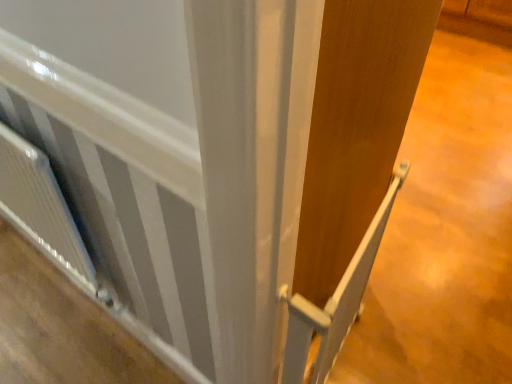
Question: Is white glossy radiator at lower left bigger than white plastic rail at center?

Choices:
 (A) yes
 (B) no

Answer: (B)

Question: From a real-world perspective, is white glossy radiator at lower left on top of white plastic rail at center?

Choices:
 (A) no
 (B) yes

Answer: (A)

Question: Is there a large distance between white glossy radiator at lower left and white plastic rail at center?

Choices:
 (A) yes
 (B) no

Answer: (B)

Question: Is white glossy radiator at lower left positioned before white plastic rail at center?

Choices:
 (A) yes
 (B) no

Answer: (B)

Question: From a real-world perspective, is white glossy radiator at lower left located beneath white plastic rail at center?

Choices:
 (A) yes
 (B) no

Answer: (A)

Question: Which is correct: white textured radiator at lower left is inside white plastic rail at center, or outside of it?

Choices:
 (A) outside
 (B) inside

Answer: (A)

Question: Considering the positions of white textured radiator at lower left and white plastic rail at center in the image, is white textured radiator at lower left taller or shorter than white plastic rail at center?

Choices:
 (A) tall
 (B) short

Answer: (A)

Question: From the image's perspective, relative to white plastic rail at center, is white textured radiator at lower left above or below?

Choices:
 (A) above
 (B) below

Answer: (A)

Question: Looking at the image, does white textured radiator at lower left seem bigger or smaller compared to white plastic rail at center?

Choices:
 (A) big
 (B) small

Answer: (A)

Question: Considering the positions of white plastic rail at center and white glossy radiator at lower left in the image, is white plastic rail at center taller or shorter than white glossy radiator at lower left?

Choices:
 (A) short
 (B) tall

Answer: (B)

Question: From the image's perspective, is white plastic rail at center located above or below white glossy radiator at lower left?

Choices:
 (A) above
 (B) below

Answer: (A)

Question: From a real-world perspective, is white plastic rail at center positioned above or below white glossy radiator at lower left?

Choices:
 (A) below
 (B) above

Answer: (B)

Question: Considering the positions of point (328, 352) and point (61, 307), is point (328, 352) closer or farther from the camera than point (61, 307)?

Choices:
 (A) closer
 (B) farther

Answer: (A)

Question: Is point (124, 336) closer or farther from the camera than point (79, 274)?

Choices:
 (A) farther
 (B) closer

Answer: (A)

Question: From a real-world perspective, relative to white textured radiator at lower left, is white glossy radiator at lower left vertically above or below?

Choices:
 (A) above
 (B) below

Answer: (B)